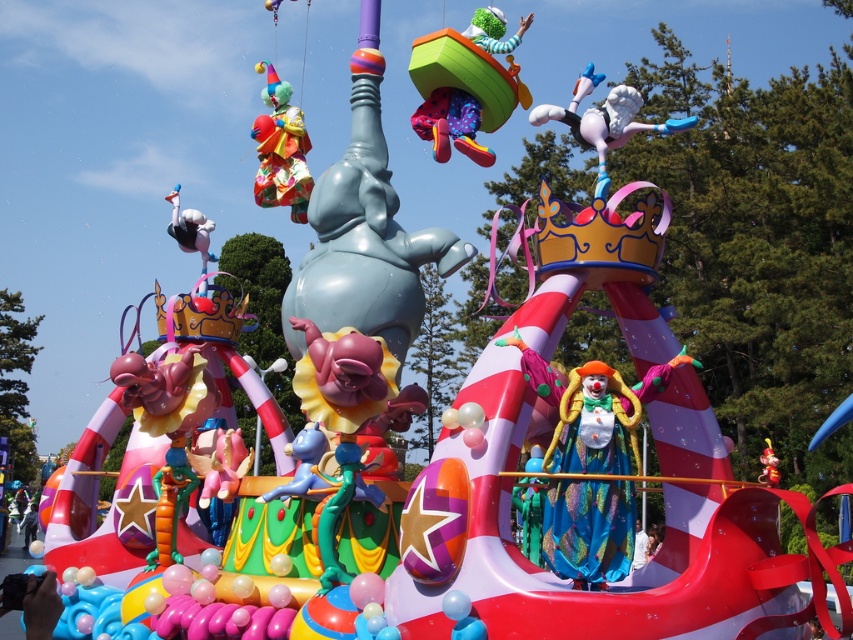
Question: Is multicolored fabric clown at center thinner than white glossy bird at upper right?

Choices:
 (A) yes
 (B) no

Answer: (A)

Question: Among these points, which one is nearest to the camera?

Choices:
 (A) (587, 109)
 (B) (457, 112)
 (C) (256, 68)
 (D) (32, 522)

Answer: (A)

Question: Can you confirm if white glossy bird at upper right is positioned to the left of matte blue clown at center?

Choices:
 (A) no
 (B) yes

Answer: (A)

Question: Estimate the real-world distances between objects in this image. Which object is closer to the multicolored fabric clown at upper left?

Choices:
 (A) matte green plastic boat at upper center
 (B) white glossy bird at upper right

Answer: (A)

Question: Which object is farther from the camera taking this photo?

Choices:
 (A) matte blue clown at center
 (B) shiny red toy at center
 (C) matte green plastic boat at upper center

Answer: (A)

Question: Does multicolored fabric clown at upper left appear on the right side of matte blue clown at center?

Choices:
 (A) yes
 (B) no

Answer: (A)